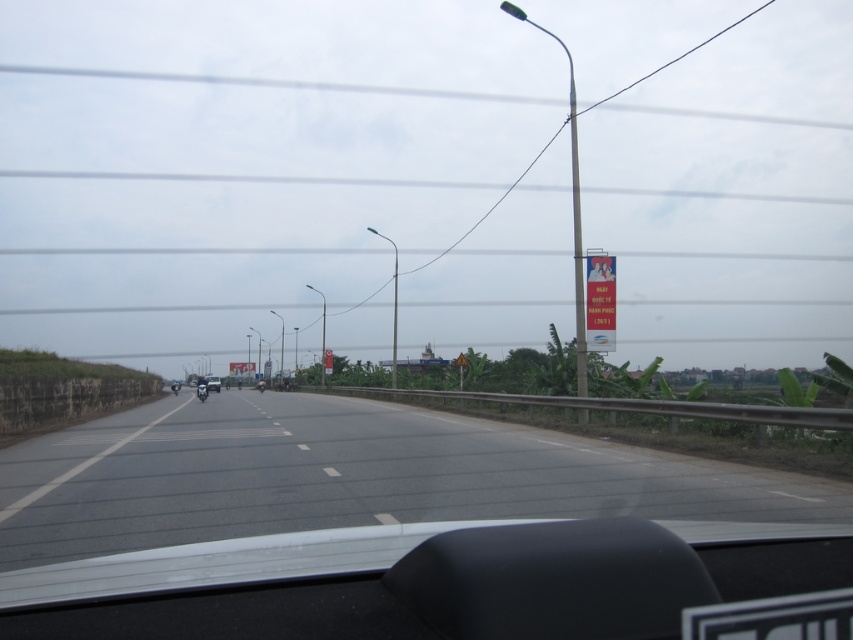
Looking at this image, you are a pedestrian standing on the sidewalk next to the road. You see two motorcycles, a black glossy motorcycle at center and a metallic silver motorcycle at center. Which motorcycle is closer to the concrete barrier on the left side of the road?

The black glossy motorcycle at center is to the left of the metallic silver motorcycle at center, so it is closer to the concrete barrier on the left side of the road.

You are a delivery driver who needs to pass between two motorcycles on the road. The motorcycles are a black glossy motorcycle at center and a metallic silver motorcycle at center. Which motorcycle should you choose to pass through if you need a wider path?

The black glossy motorcycle at center has a larger width than the metallic silver motorcycle at center, so you should choose to pass through the path next to the black glossy motorcycle at center for a wider passage.

You are driving a car that is 4.5 meters long. You want to safely stop before reaching the metallic pole at right. The road has a speed limit of 60 km per hour. Can you stop in time if you start braking immediately?

The metallic pole at right is 19.07 meters away. To determine if you can stop in time, calculate the braking distance at 60 kmph. Assuming average braking capability, a car traveling at 60 kmph requires about 38 meters to stop. Since 19.07 meters is less than 38 meters, you cannot stop in time before hitting the pole.